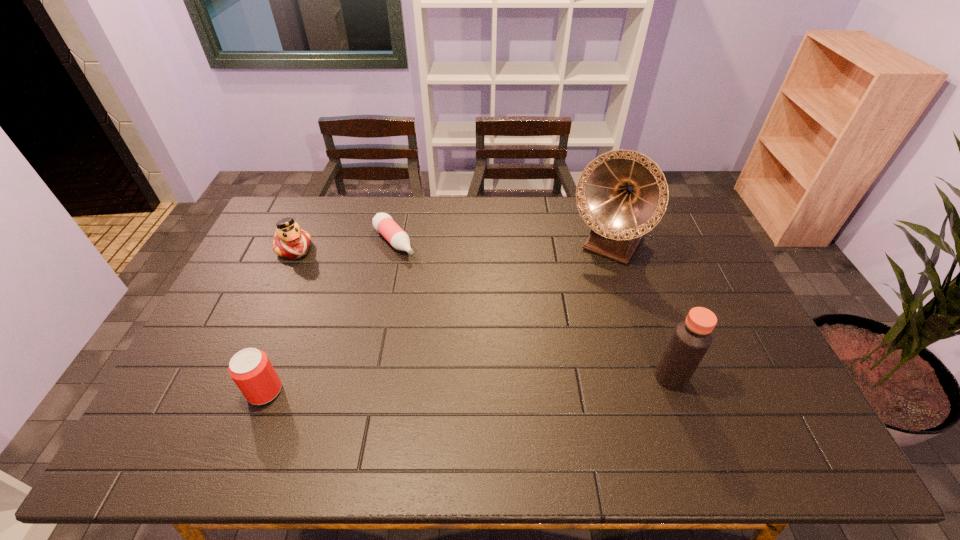
The height and width of the screenshot is (540, 960). I want to click on object that is the fourth closest to the vinegar, so click(x=290, y=241).

This screenshot has width=960, height=540. In order to click on vacant region that satisfies the following two spatial constraints: 1. on the front side of the duck; 2. on the left side of the beer can in this screenshot , I will do `click(230, 391)`.

Where is `vacant region that satisfies the following two spatial constraints: 1. on the front side of the third object from left to right; 2. on the left side of the second tallest object`? The image size is (960, 540). vacant region that satisfies the following two spatial constraints: 1. on the front side of the third object from left to right; 2. on the left side of the second tallest object is located at coordinates (367, 377).